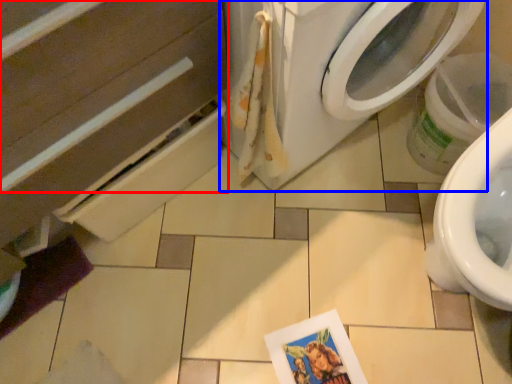
Question: Among these objects, which one is nearest to the camera, drawer (highlighted by a red box) or washing machine (highlighted by a blue box)?

Choices:
 (A) drawer
 (B) washing machine

Answer: (A)